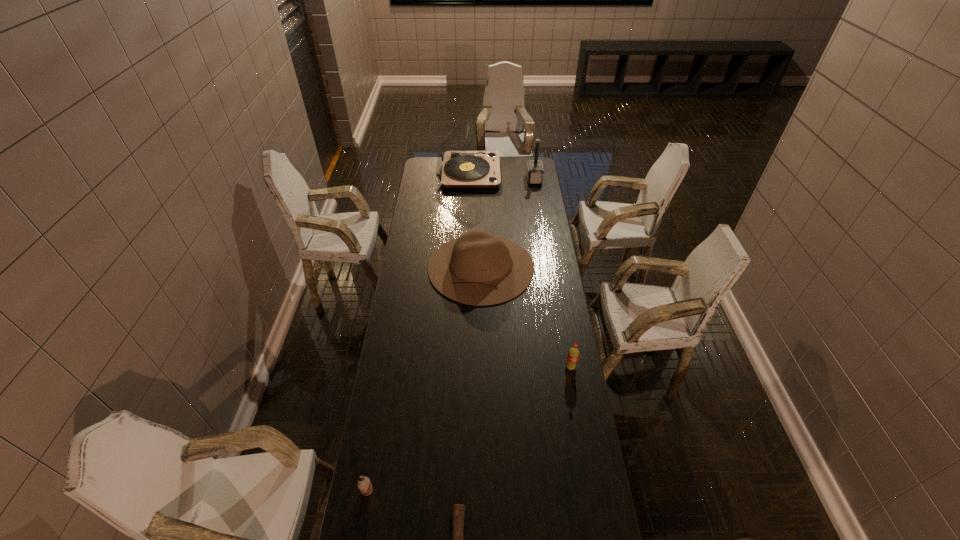
Where is `record player`? The height and width of the screenshot is (540, 960). record player is located at coordinates pos(456,168).

In order to click on the farther hammer in this screenshot , I will do `click(534, 170)`.

Identify the location of the right hammer. The height and width of the screenshot is (540, 960). (534, 170).

What are the coordinates of `the fourth shortest object` in the screenshot? It's located at (478, 268).

Locate an element on the screen. The image size is (960, 540). the fourth nearest object is located at coordinates (478, 268).

Where is `the third nearest object`? The width and height of the screenshot is (960, 540). the third nearest object is located at coordinates (573, 354).

At what (x,y) coordinates should I click in order to perform the action: click on the third shortest object. Please return your answer as a coordinate pair (x, y). This screenshot has height=540, width=960. Looking at the image, I should click on (x=573, y=354).

The image size is (960, 540). I want to click on chocolate milk, so click(x=364, y=484).

Image resolution: width=960 pixels, height=540 pixels. Find the location of `the leftmost object`. the leftmost object is located at coordinates (364, 484).

Locate an element on the screen. The image size is (960, 540). vacant area situated with the tonearm facing the front of the tallest object is located at coordinates (510, 173).